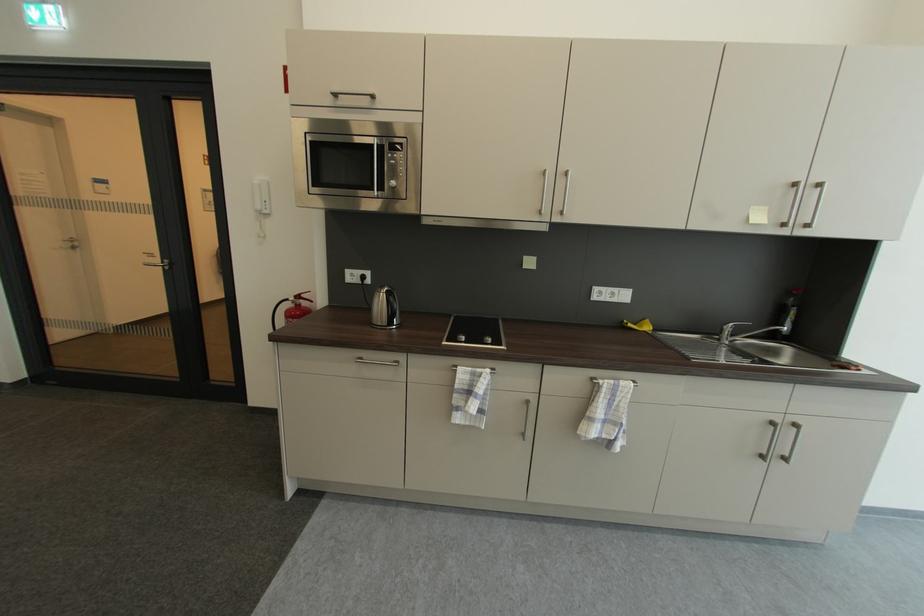
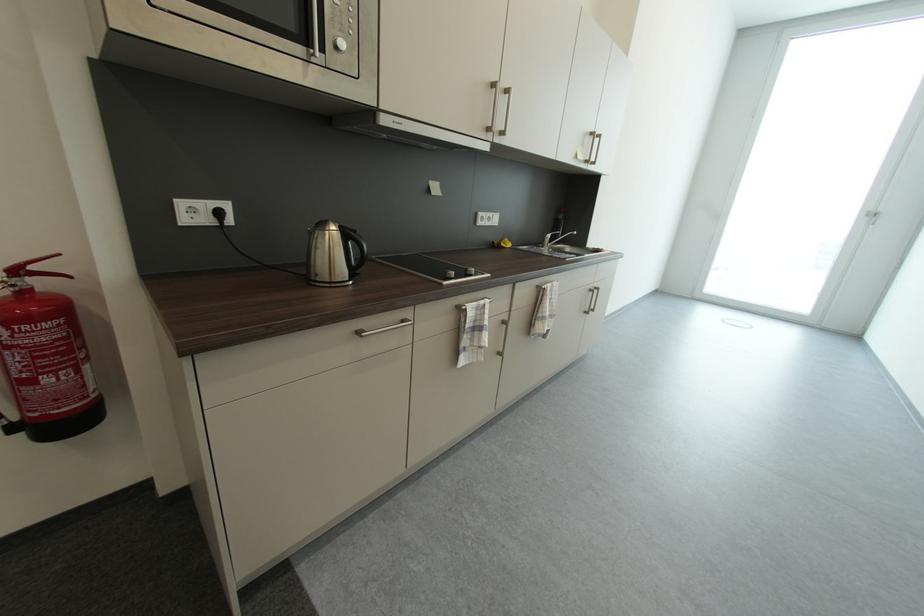
Locate, in the second image, the point that corresponds to the point at 779,424 in the first image.

(598, 292)